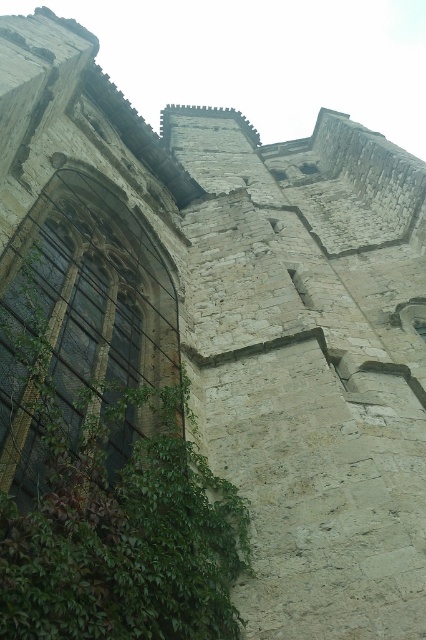
Measure the distance from green leafy plant at lower left to dark glass window at left.

green leafy plant at lower left is 10.34 meters from dark glass window at left.

Can you confirm if green leafy plant at lower left is bigger than dark glass window at left?

No.

Who is more forward, [149,388] or [83,211]?

Point [149,388]

Where is `green leafy plant at lower left`? green leafy plant at lower left is located at coordinates (123, 534).